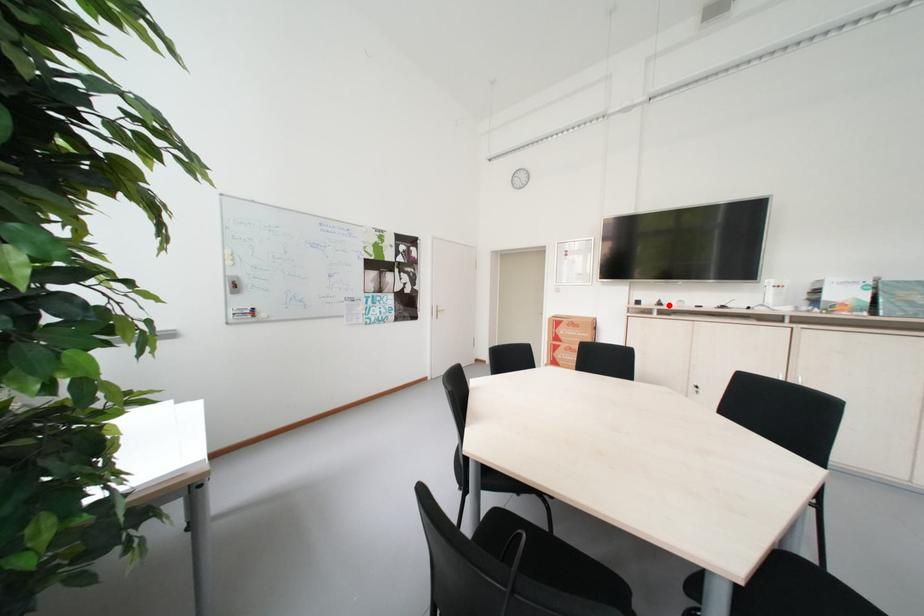
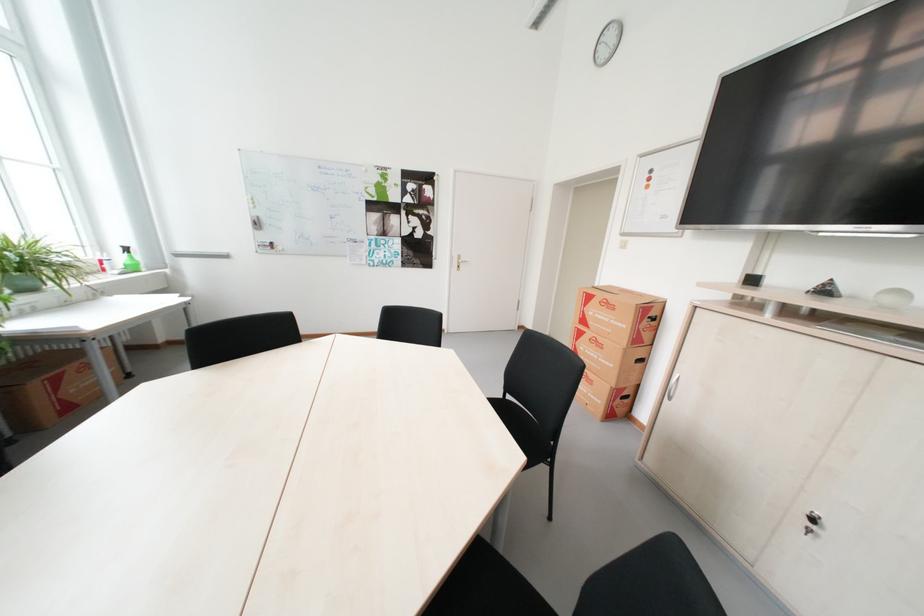
Locate, in the second image, the point that corresponds to the highlighted location in the first image.

(835, 292)